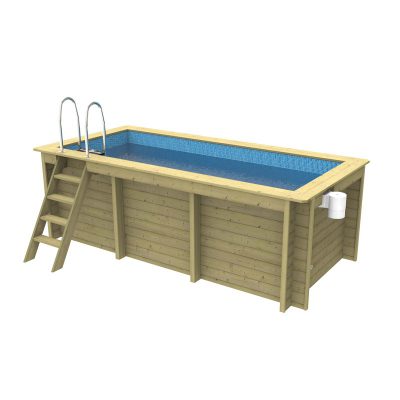
Locate an element on the screen. Image resolution: width=400 pixels, height=400 pixels. ladder is located at coordinates (60, 195).